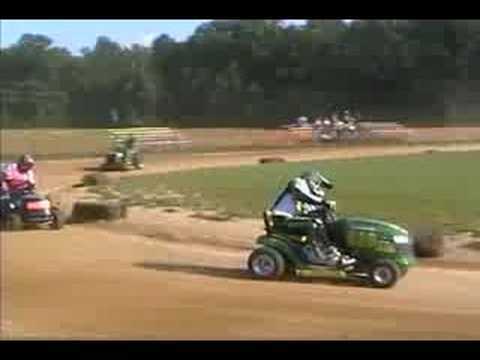
Identify the location of places to sit. 168,135, 386,124.